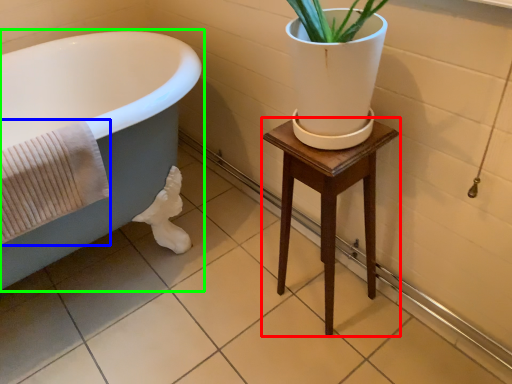
Question: Based on their relative distances, which object is nearer to furniture (highlighted by a red box)? Choose from bath towel (highlighted by a blue box) and bathtub (highlighted by a green box).

Choices:
 (A) bath towel
 (B) bathtub

Answer: (A)